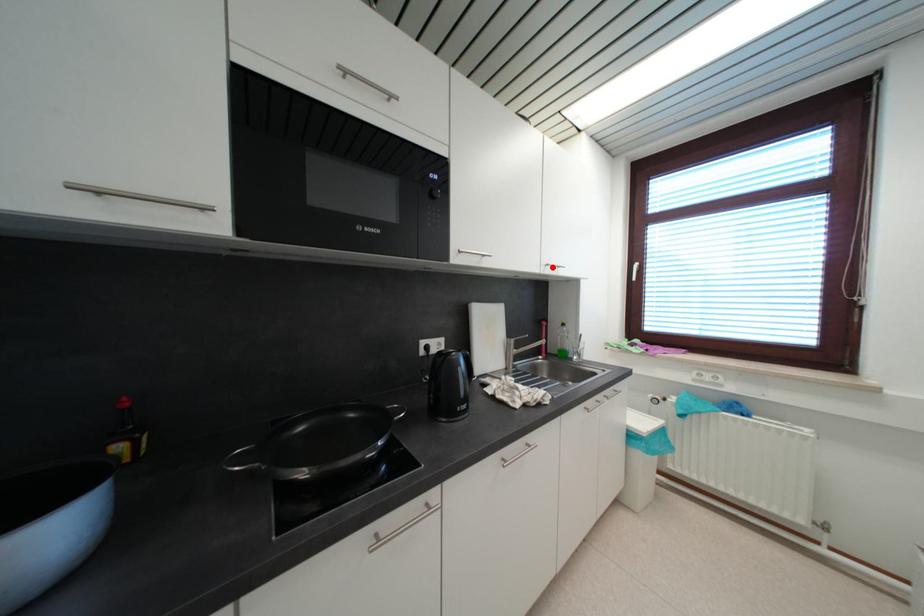
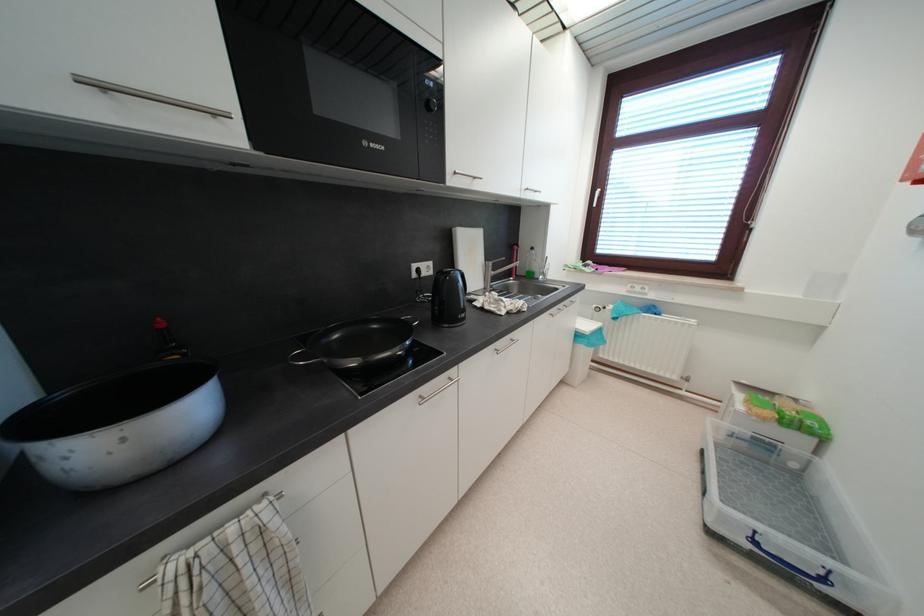
In the second image, find the point that corresponds to the highlighted location in the first image.

(532, 192)